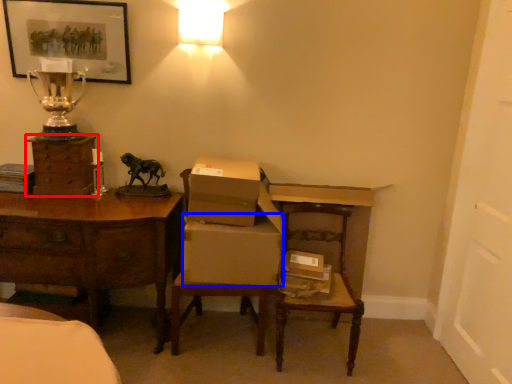
Question: Which object is closer to the camera taking this photo, chest of drawers (highlighted by a red box) or cardboard box (highlighted by a blue box)?

Choices:
 (A) chest of drawers
 (B) cardboard box

Answer: (B)